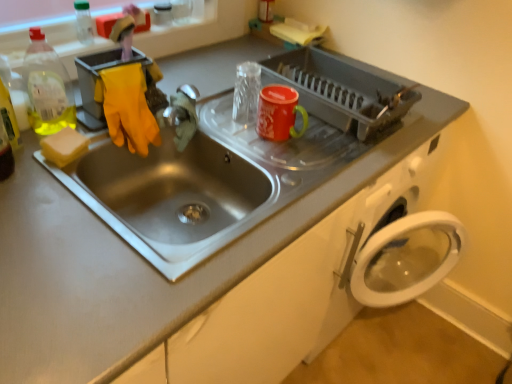
Find the location of a particular element. vacant area that is in front of translucent plastic bottle at upper left, which ranks as the 2th bottle in back-to-front order is located at coordinates (33, 164).